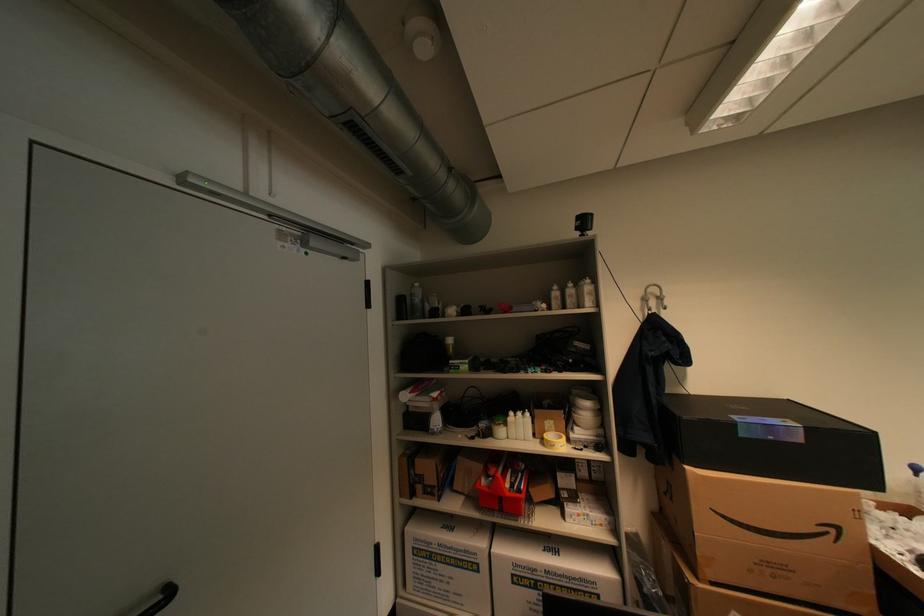
Where is `black door handle`? This screenshot has width=924, height=616. black door handle is located at coordinates (164, 599).